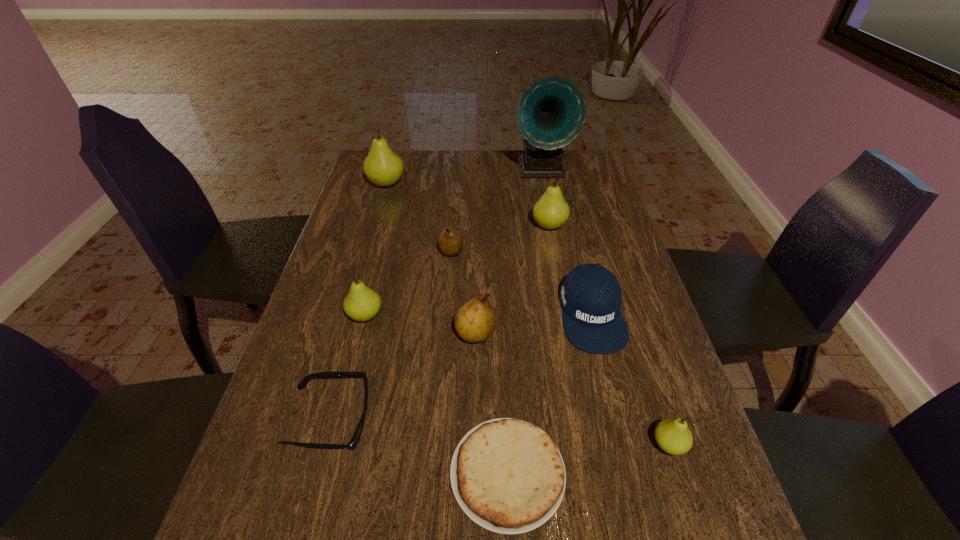
Find the location of a particular element. Image resolution: width=960 pixels, height=540 pixels. green pear that is the second closest one to the third biggest green pear is located at coordinates (383, 167).

Where is `blank space that satisfies the following two spatial constraints: 1. on the front side of the tallest pear; 2. on the left side of the second smallest green pear`? blank space that satisfies the following two spatial constraints: 1. on the front side of the tallest pear; 2. on the left side of the second smallest green pear is located at coordinates (348, 316).

At what (x,y) coordinates should I click in order to perform the action: click on free location that satisfies the following two spatial constraints: 1. on the front-facing side of the baseball cap; 2. on the front-facing side of the second shortest object. Please return your answer as a coordinate pair (x, y). Looking at the image, I should click on (618, 420).

Image resolution: width=960 pixels, height=540 pixels. Identify the location of vacant position in the image that satisfies the following two spatial constraints: 1. on the front-facing side of the blue baseball cap; 2. on the right side of the smallest green pear. (624, 445).

Identify the location of free point that satisfies the following two spatial constraints: 1. on the front-facing side of the sunglasses; 2. on the back side of the shortest object. The image size is (960, 540). (317, 474).

Identify the location of vacant position in the image that satisfies the following two spatial constraints: 1. from the horn of the smallest green pear; 2. on the left side of the tallest object. This screenshot has height=540, width=960. (597, 445).